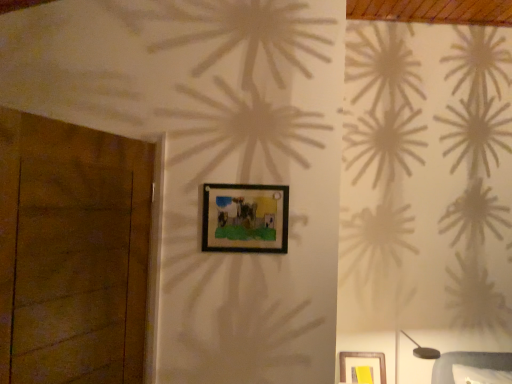
Question: Does brown wooden door at left turn towards metallic gray table lamp at lower right?

Choices:
 (A) no
 (B) yes

Answer: (A)

Question: Is metallic gray table lamp at lower right inside brown wooden door at left?

Choices:
 (A) yes
 (B) no

Answer: (B)

Question: Does brown wooden door at left lie in front of metallic gray table lamp at lower right?

Choices:
 (A) no
 (B) yes

Answer: (B)

Question: From the image's perspective, would you say brown wooden door at left is positioned over metallic gray table lamp at lower right?

Choices:
 (A) no
 (B) yes

Answer: (B)

Question: Considering the relative sizes of brown wooden door at left and metallic gray table lamp at lower right in the image provided, is brown wooden door at left bigger than metallic gray table lamp at lower right?

Choices:
 (A) yes
 (B) no

Answer: (A)

Question: Is brown wooden door at left shorter than metallic gray table lamp at lower right?

Choices:
 (A) no
 (B) yes

Answer: (A)

Question: Is black matte picture frame at center touching brown wooden door at left?

Choices:
 (A) yes
 (B) no

Answer: (B)

Question: Considering the relative sizes of black matte picture frame at center and brown wooden door at left in the image provided, is black matte picture frame at center taller than brown wooden door at left?

Choices:
 (A) no
 (B) yes

Answer: (A)

Question: Would you say brown wooden door at left is part of black matte picture frame at center's contents?

Choices:
 (A) no
 (B) yes

Answer: (A)

Question: Does black matte picture frame at center have a lesser width compared to brown wooden door at left?

Choices:
 (A) yes
 (B) no

Answer: (A)

Question: Is black matte picture frame at center further to the viewer compared to brown wooden door at left?

Choices:
 (A) yes
 (B) no

Answer: (A)

Question: Is black matte picture frame at center at the left side of brown wooden door at left?

Choices:
 (A) yes
 (B) no

Answer: (B)

Question: Is metallic gray table lamp at lower right outside brown wooden door at left?

Choices:
 (A) no
 (B) yes

Answer: (B)